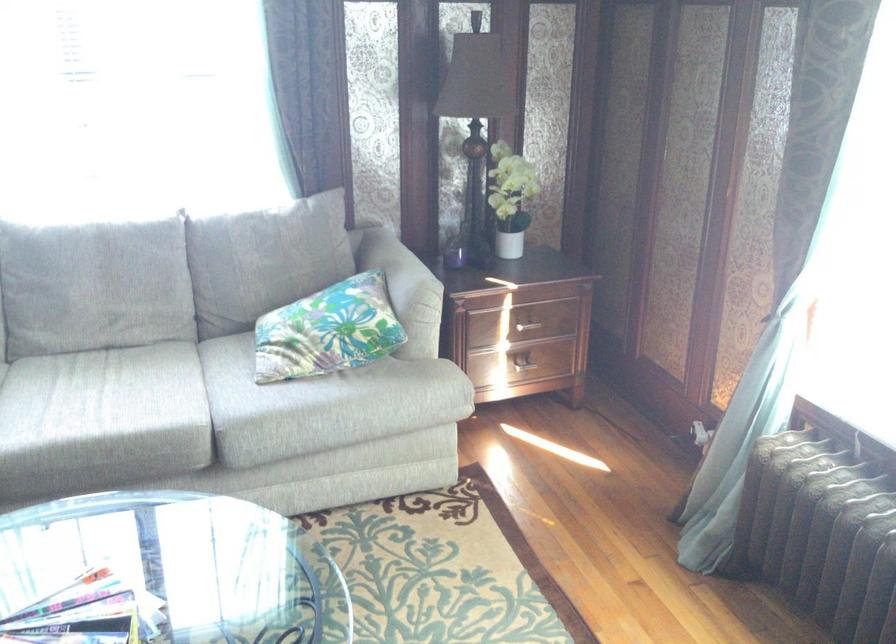
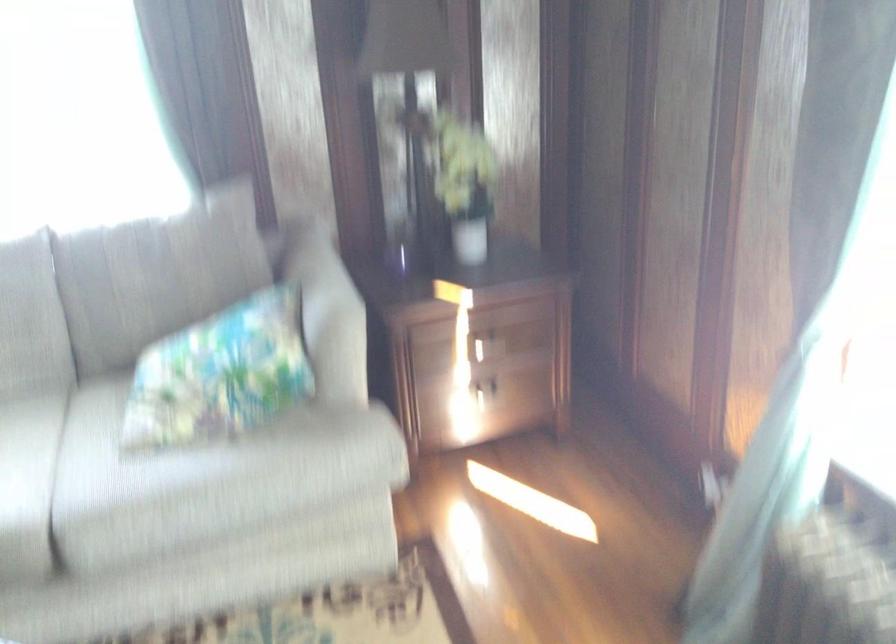
Locate, in the second image, the point that corresponds to the point at 519,361 in the first image.

(486, 391)